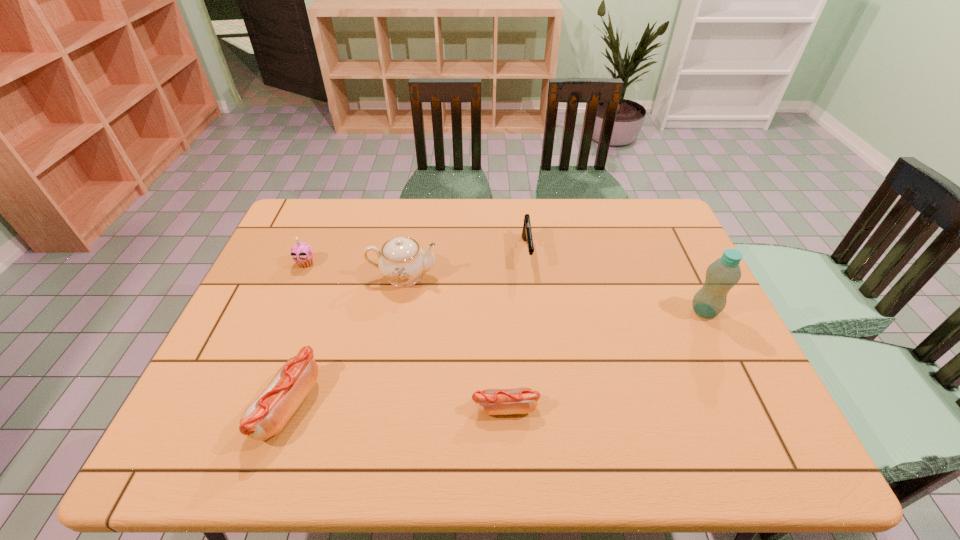
Locate an element on the screen. This screenshot has width=960, height=540. free space between the gun and the fifth shortest object is located at coordinates (465, 264).

Where is `free point between the shortest object and the fifth shortest object`? free point between the shortest object and the fifth shortest object is located at coordinates (454, 342).

This screenshot has width=960, height=540. Find the location of `unoccupied position between the left sausage and the gun`. unoccupied position between the left sausage and the gun is located at coordinates click(x=407, y=329).

Image resolution: width=960 pixels, height=540 pixels. Find the location of `unoccupied area between the taller sausage and the water bottle`. unoccupied area between the taller sausage and the water bottle is located at coordinates (496, 358).

The image size is (960, 540). What are the coordinates of `free spot between the left sausage and the shortest object` in the screenshot? It's located at (396, 407).

This screenshot has height=540, width=960. Find the location of `empty space that is in between the third object from right to left and the cupcake`. empty space that is in between the third object from right to left and the cupcake is located at coordinates (405, 335).

Identify the location of empty space that is in between the second object from right to left and the shortest object. The width and height of the screenshot is (960, 540). (516, 330).

Where is `object that stands as the fifth closest to the third object from left to right`? object that stands as the fifth closest to the third object from left to right is located at coordinates (723, 274).

Identify the location of object that is the fourth closest to the tallest object. The image size is (960, 540). (x=267, y=415).

Identify the location of free space that satisfies the following two spatial constraints: 1. at the aiming end of the fifth object from left to right; 2. at the spout of the chinaware. (530, 276).